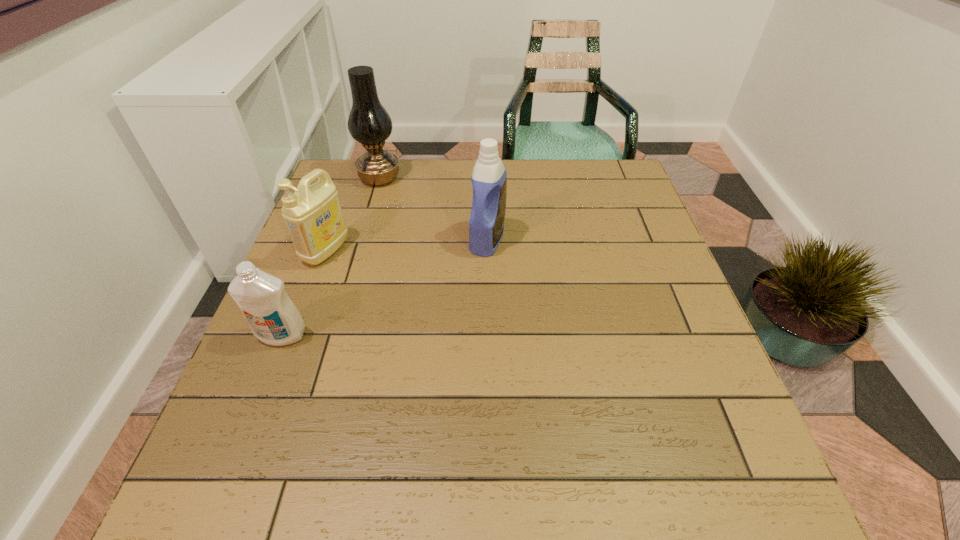
At what (x,y) coordinates should I click in order to perform the action: click on oil lamp. Please return your answer as a coordinate pair (x, y). The height and width of the screenshot is (540, 960). Looking at the image, I should click on (369, 123).

Find the location of a particular element. the tallest detergent is located at coordinates (489, 178).

This screenshot has height=540, width=960. I want to click on the rightmost object, so click(x=489, y=178).

Where is `the nearest detergent`? The width and height of the screenshot is (960, 540). the nearest detergent is located at coordinates (272, 317).

Locate an element on the screen. The image size is (960, 540). vacant space situated on the front of the oil lamp is located at coordinates (355, 260).

Identify the location of blank area located 0.090m on the right of the tallest detergent. (540, 240).

This screenshot has width=960, height=540. Find the location of `vacant region located on the right of the nearest detergent`. vacant region located on the right of the nearest detergent is located at coordinates (394, 335).

This screenshot has height=540, width=960. What are the coordinates of `object that is at the far edge` in the screenshot? It's located at (369, 123).

Locate an element on the screen. oil lamp that is at the left edge is located at coordinates (369, 123).

The image size is (960, 540). What are the coordinates of `object that is positioned at the far left corner` in the screenshot? It's located at (369, 123).